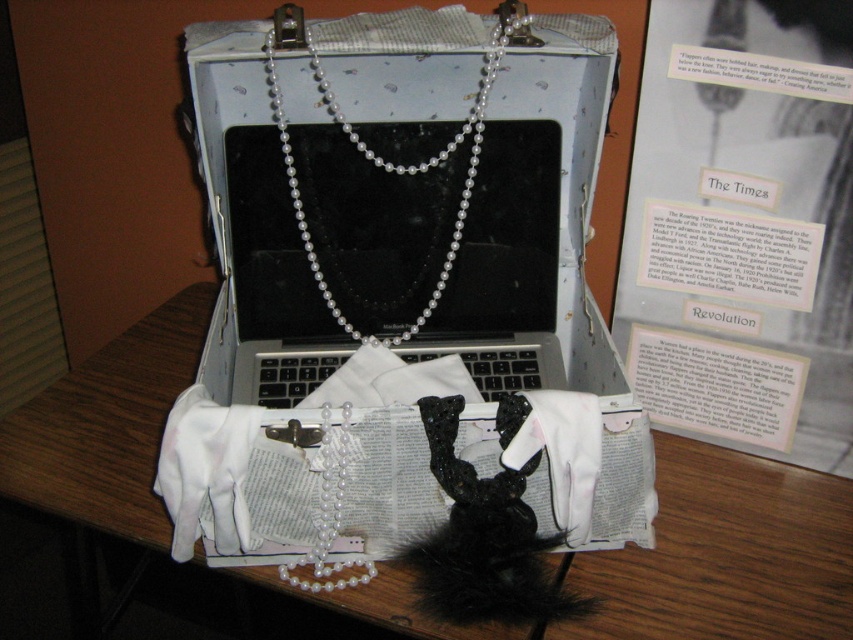
Question: Which point is closer to the camera?

Choices:
 (A) pearl necklace at center
 (B) wooden table at center
 (C) white fabric purse at center

Answer: (C)

Question: Among these objects, which one is farthest from the camera?

Choices:
 (A) pearl necklace at center
 (B) wooden table at center
 (C) white fabric purse at center

Answer: (A)

Question: Which of the following is the closest to the observer?

Choices:
 (A) pearl necklace at center
 (B) wooden table at center

Answer: (B)

Question: Can you confirm if wooden table at center is positioned above pearl necklace at center?

Choices:
 (A) no
 (B) yes

Answer: (A)

Question: Is wooden table at center to the left of white fabric purse at center from the viewer's perspective?

Choices:
 (A) no
 (B) yes

Answer: (B)

Question: Can you confirm if wooden table at center is positioned below white fabric purse at center?

Choices:
 (A) yes
 (B) no

Answer: (A)